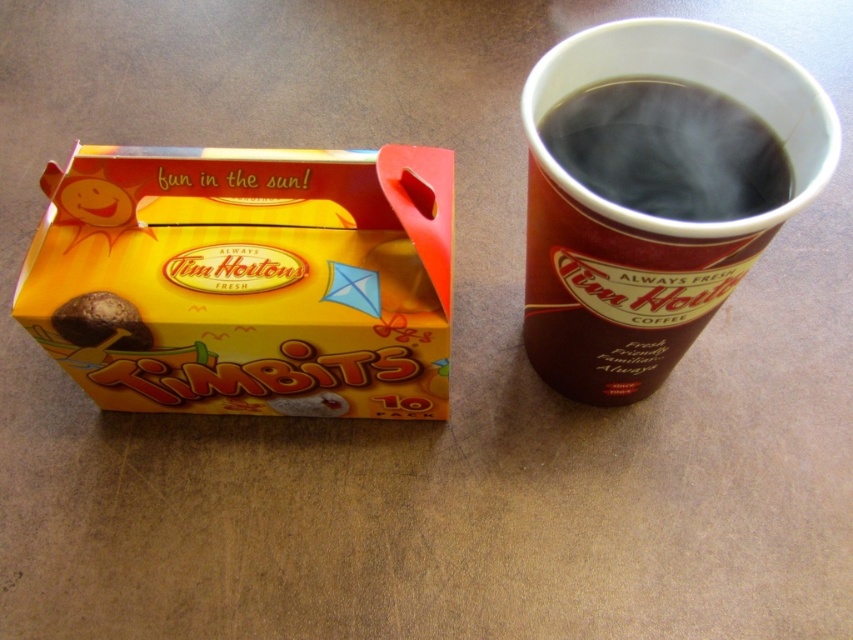
Based on the photo, does yellow cardboard box at upper left have a greater width compared to black paper cup at right?

Correct, the width of yellow cardboard box at upper left exceeds that of black paper cup at right.

Is yellow cardboard box at upper left positioned in front of black paper cup at right?

No, yellow cardboard box at upper left is behind black paper cup at right.

Between point (128, 147) and point (602, 100), which one is positioned in front?

Point (602, 100) is more forward.

Identify the location of yellow cardboard box at upper left. (247, 280).

Which is more to the left, yellow cardboard box at upper left or black glossy cup at upper right?

From the viewer's perspective, yellow cardboard box at upper left appears more on the left side.

Is yellow cardboard box at upper left in front of black glossy cup at upper right?

No, it is behind black glossy cup at upper right.

Find the location of `yellow cardboard box at upper left`. yellow cardboard box at upper left is located at coordinates (247, 280).

Locate an element on the screen. Image resolution: width=853 pixels, height=640 pixels. yellow cardboard box at upper left is located at coordinates (247, 280).

This screenshot has width=853, height=640. What do you see at coordinates (654, 192) in the screenshot?
I see `black paper cup at right` at bounding box center [654, 192].

Is black paper cup at right taller than black glossy cup at upper right?

Yes.

Image resolution: width=853 pixels, height=640 pixels. What do you see at coordinates (654, 192) in the screenshot?
I see `black paper cup at right` at bounding box center [654, 192].

You are a GUI agent. You are given a task and a screenshot of the screen. Output one action in this format:
    pyautogui.click(x=<x>, y=<y>)
    Task: Click on the black paper cup at right
    
    Given the screenshot: What is the action you would take?
    pyautogui.click(x=654, y=192)